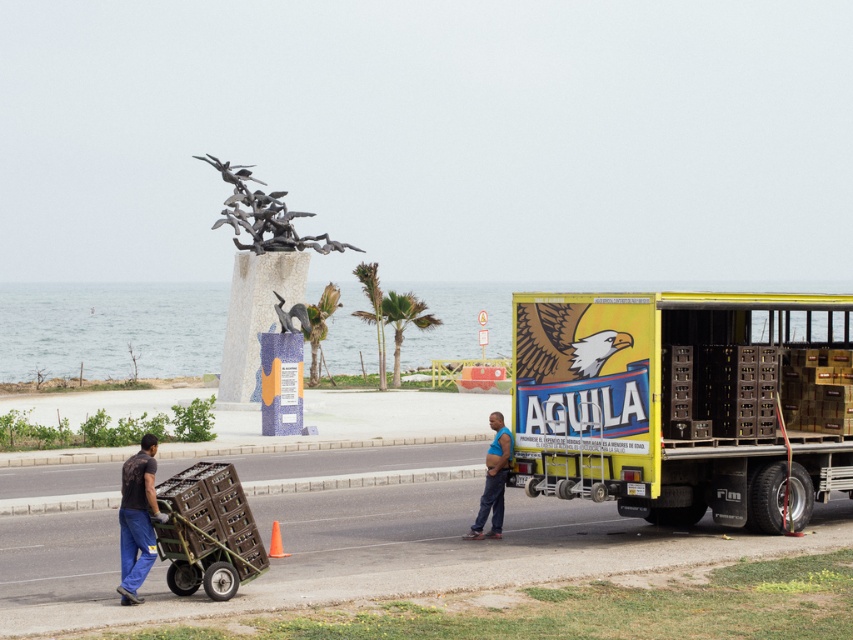
Does yellow matte trailer truck at right have a smaller size compared to dark blue jeans at lower left?

Incorrect, yellow matte trailer truck at right is not smaller in size than dark blue jeans at lower left.

Which is below, yellow matte trailer truck at right or dark blue jeans at lower left?

Positioned lower is dark blue jeans at lower left.

Describe the element at coordinates (685, 403) in the screenshot. I see `yellow matte trailer truck at right` at that location.

I want to click on yellow matte trailer truck at right, so click(x=685, y=403).

Looking at this image, is yellow matte trailer truck at right smaller than wooden crates at lower left?

No, yellow matte trailer truck at right is not smaller than wooden crates at lower left.

Between point (523, 435) and point (164, 496), which one is positioned behind?

The point (523, 435) is more distant.

Identify the location of yellow matte trailer truck at right. The width and height of the screenshot is (853, 640). (685, 403).

The image size is (853, 640). What do you see at coordinates (685, 403) in the screenshot?
I see `yellow matte trailer truck at right` at bounding box center [685, 403].

Looking at this image, does yellow matte trailer truck at right come behind blue fabric shirt at center?

That is False.

This screenshot has height=640, width=853. In order to click on yellow matte trailer truck at right in this screenshot , I will do `click(685, 403)`.